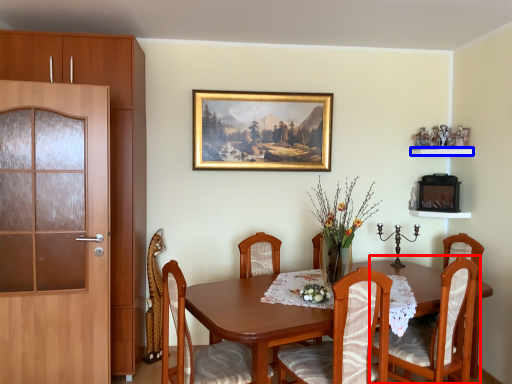
Question: Which point is further to the camera, chair (highlighted by a red box) or shelf (highlighted by a blue box)?

Choices:
 (A) chair
 (B) shelf

Answer: (B)